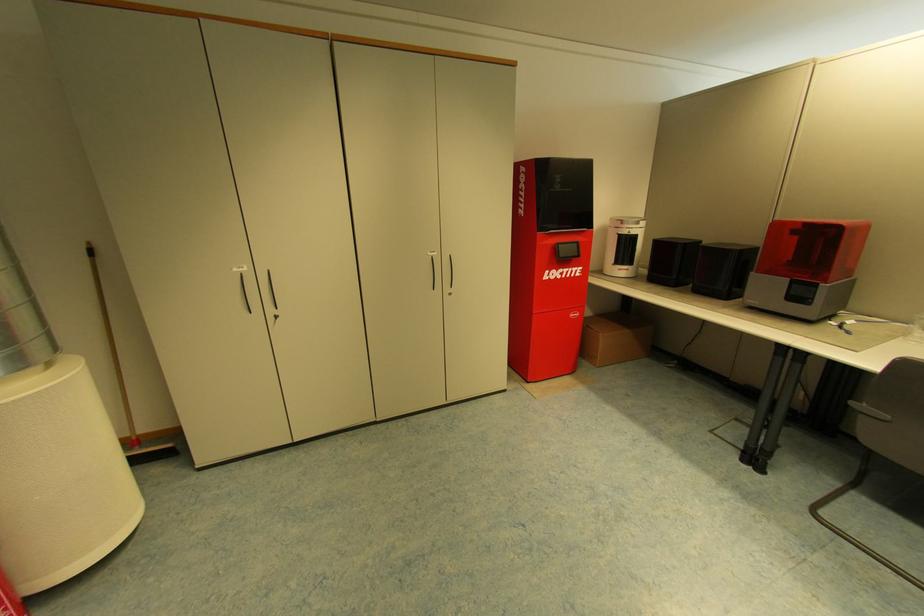
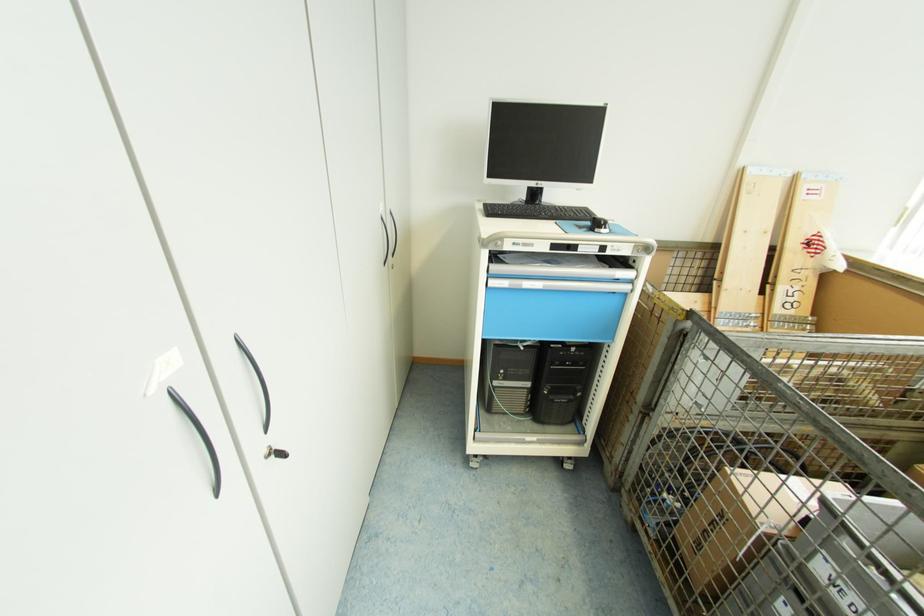
The images are taken continuously from a first-person perspective. In which direction are you moving?

The movement direction of the cameraman is right, forward.